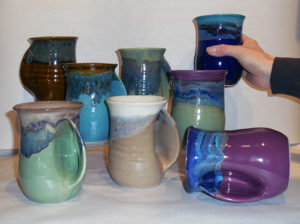
Find the location of `wall`. wall is located at coordinates (95, 36), (268, 5).